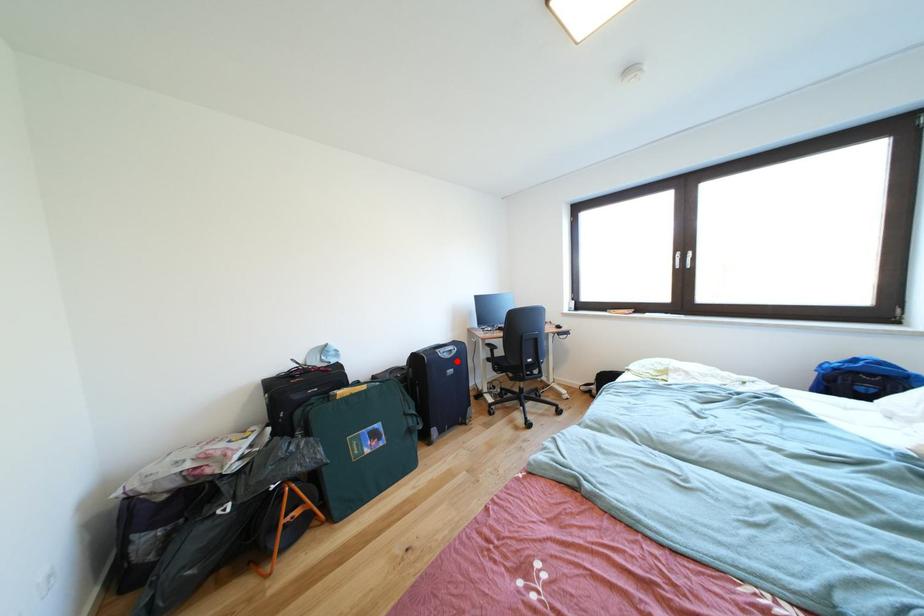
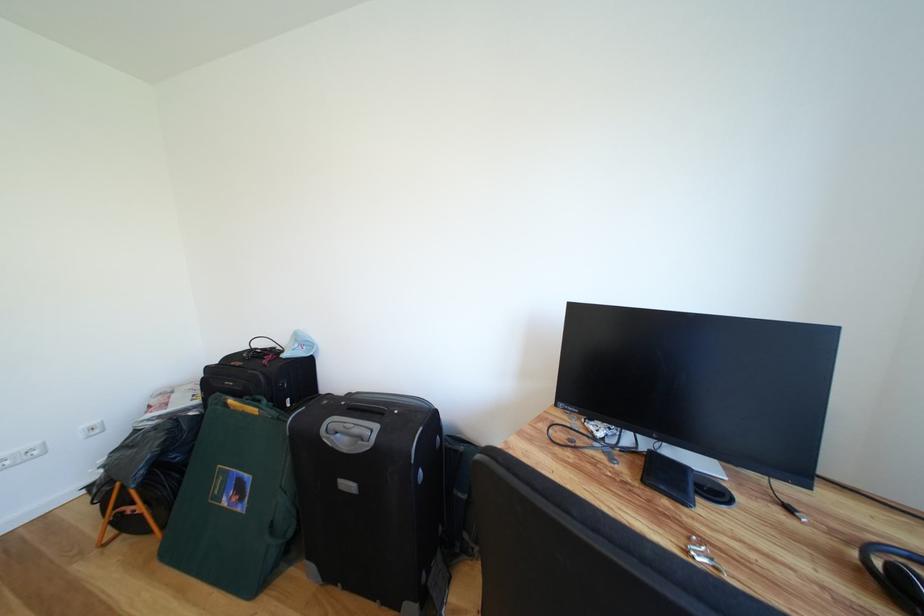
In the second image, find the point that corresponds to the highlighted location in the first image.

(353, 455)